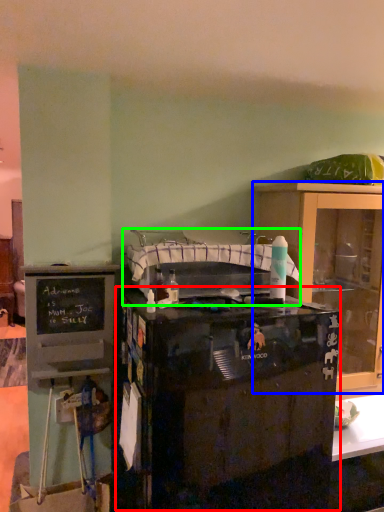
Question: Which object is the closest to the desk (highlighted by a red box)? Choose among these: cabinetry (highlighted by a blue box) or sink (highlighted by a green box).

Choices:
 (A) cabinetry
 (B) sink

Answer: (B)